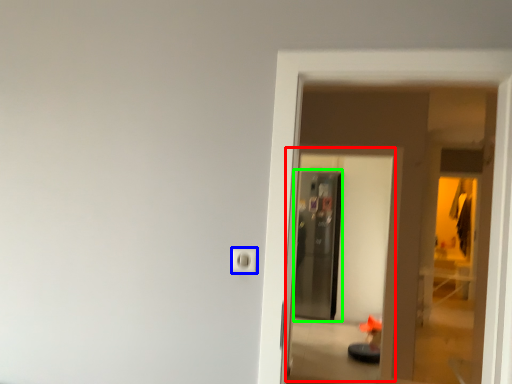
Question: Which is nearer to the screen door (highlighted by a red box)? electric outlet (highlighted by a blue box) or screen door (highlighted by a green box).

Choices:
 (A) electric outlet
 (B) screen door

Answer: (B)